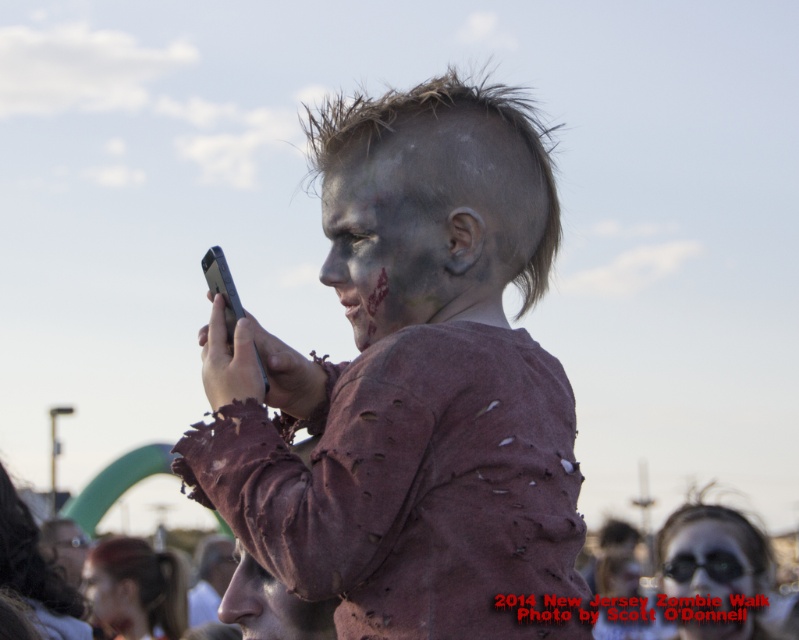
Who is lower down, matte brown shirt at center or gray matte face at center?

matte brown shirt at center is below.

Can you confirm if matte brown shirt at center is positioned above gray matte face at center?

Actually, matte brown shirt at center is below gray matte face at center.

What do you see at coordinates (412, 387) in the screenshot? Image resolution: width=799 pixels, height=640 pixels. I see `matte brown shirt at center` at bounding box center [412, 387].

This screenshot has width=799, height=640. I want to click on matte brown shirt at center, so click(x=412, y=387).

Does gray matte face at center have a larger size compared to matte gray face paint at center?

Yes.

Who is more distant from viewer, (x=404, y=291) or (x=89, y=568)?

The point (x=89, y=568) is behind.

You are a GUI agent. You are given a task and a screenshot of the screen. Output one action in this format:
    pyautogui.click(x=<x>, y=<y>)
    Task: Click on the gray matte face at center
    Image resolution: width=799 pixels, height=640 pixels.
    Given the screenshot: What is the action you would take?
    pyautogui.click(x=392, y=240)

Does matte brown shirt at center appear under matte gray face at center?

Incorrect, matte brown shirt at center is not positioned below matte gray face at center.

Is matte brown shirt at center positioned before matte gray face at center?

Yes, it is.

Where is `matte brown shirt at center`? matte brown shirt at center is located at coordinates (412, 387).

Find the location of a particular element. matte brown shirt at center is located at coordinates (412, 387).